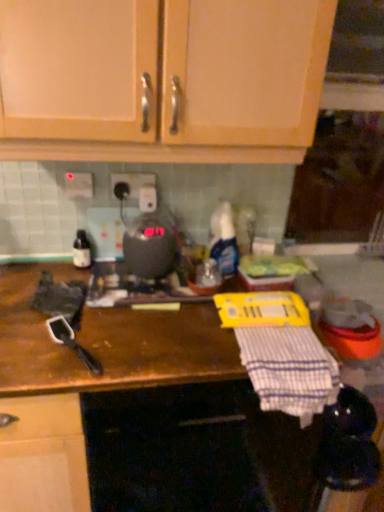
What do you see at coordinates (81, 250) in the screenshot? Image resolution: width=384 pixels, height=512 pixels. I see `matte glass bottle at left, the 1th bottle viewed from the left` at bounding box center [81, 250].

Identify the location of white plastic electric outlet at center, the 2th electric outlet positioned from the left. The image size is (384, 512). click(x=133, y=182).

You are a GUI agent. You are given a task and a screenshot of the screen. Output one action in this format:
    pyautogui.click(x=<x>, y=<y>)
    Task: Click on the wooden cabinet doors at upper center
    The width and height of the screenshot is (384, 512).
    Given the screenshot: What is the action you would take?
    pyautogui.click(x=162, y=79)

This screenshot has width=384, height=512. What do you see at coordinates (148, 412) in the screenshot?
I see `brown wooden countertop at center` at bounding box center [148, 412].

The image size is (384, 512). Describe the element at coordinates (78, 184) in the screenshot. I see `white plastic electric outlet at upper center, arranged as the 2th electric outlet when viewed from the right` at that location.

The height and width of the screenshot is (512, 384). Identify the location of white plastic electric outlet at upper center, arranged as the 2th electric outlet when viewed from the right. (78, 184).

Locate an element on the screen. translucent plastic spray bottle at center, acting as the second bottle starting from the left is located at coordinates (224, 239).

Image resolution: width=384 pixels, height=512 pixels. What are the coordinates of `matte glass bottle at left, the 1th bottle viewed from the left` in the screenshot? It's located at (81, 250).

How far apart are metallic gray toaster at center and wooden cabinet doors at upper center?

The distance of metallic gray toaster at center from wooden cabinet doors at upper center is 46.27 centimeters.

Considering the relative sizes of metallic gray toaster at center and wooden cabinet doors at upper center in the image provided, is metallic gray toaster at center smaller than wooden cabinet doors at upper center?

Indeed, metallic gray toaster at center has a smaller size compared to wooden cabinet doors at upper center.

From the image's perspective, between metallic gray toaster at center and wooden cabinet doors at upper center, who is located below?

From the image's view, metallic gray toaster at center is below.

Does metallic gray toaster at center have a greater width compared to wooden cabinet doors at upper center?

Incorrect, the width of metallic gray toaster at center does not surpass that of wooden cabinet doors at upper center.

Is wooden cabinet doors at upper center outside of brown wooden countertop at center?

Yes, wooden cabinet doors at upper center is located beyond the bounds of brown wooden countertop at center.

From a real-world perspective, is wooden cabinet doors at upper center physically located above or below brown wooden countertop at center?

wooden cabinet doors at upper center is situated higher than brown wooden countertop at center in the real world.

Considering the sizes of objects wooden cabinet doors at upper center and brown wooden countertop at center in the image provided, who is wider, wooden cabinet doors at upper center or brown wooden countertop at center?

Wider between the two is brown wooden countertop at center.

Do you think matte glass bottle at left, the 1th bottle viewed from the left, is within brown wooden countertop at center, or outside of it?

matte glass bottle at left, the 1th bottle viewed from the left, is spatially situated outside brown wooden countertop at center.

From the image's perspective, relative to brown wooden countertop at center, is matte glass bottle at left, the 1th bottle viewed from the left, above or below?

matte glass bottle at left, the 1th bottle viewed from the left, is situated higher than brown wooden countertop at center in the image.

The height and width of the screenshot is (512, 384). In order to click on bottle lying on the left of brown wooden countertop at center in this screenshot , I will do `click(81, 250)`.

Considering the relative sizes of matte glass bottle at left, the 1th bottle viewed from the left, and brown wooden countertop at center in the image provided, is matte glass bottle at left, the 1th bottle viewed from the left, taller than brown wooden countertop at center?

In fact, matte glass bottle at left, the 1th bottle viewed from the left, may be shorter than brown wooden countertop at center.

Considering the sizes of objects matte glass bottle at left, the 1th bottle viewed from the left, and translucent plastic spray bottle at center, the 1th bottle when ordered from right to left, in the image provided, who is smaller, matte glass bottle at left, the 1th bottle viewed from the left, or translucent plastic spray bottle at center, the 1th bottle when ordered from right to left,?

matte glass bottle at left, the 1th bottle viewed from the left, is smaller.

Would you say matte glass bottle at left, which is the second bottle in right-to-left order, is inside or outside translucent plastic spray bottle at center, the 1th bottle when ordered from right to left?

matte glass bottle at left, which is the second bottle in right-to-left order, exists outside the volume of translucent plastic spray bottle at center, the 1th bottle when ordered from right to left.

Relative to translucent plastic spray bottle at center, acting as the second bottle starting from the left, is matte glass bottle at left, which is the second bottle in right-to-left order, in front or behind?

Clearly, matte glass bottle at left, which is the second bottle in right-to-left order, is behind translucent plastic spray bottle at center, acting as the second bottle starting from the left.

What's the angular difference between matte glass bottle at left, the 1th bottle viewed from the left, and translucent plastic spray bottle at center, the 1th bottle when ordered from right to left,'s facing directions?

The angular difference between matte glass bottle at left, the 1th bottle viewed from the left, and translucent plastic spray bottle at center, the 1th bottle when ordered from right to left, is 0.00238 degrees.

Is matte glass bottle at left, the 1th bottle viewed from the left, positioned behind white plastic electric outlet at center, the 2th electric outlet positioned from the left?

Yes, it is.

From a real-world perspective, is matte glass bottle at left, the 1th bottle viewed from the left, positioned above or below white plastic electric outlet at center, the 1th electric outlet in the right-to-left sequence?

From a real-world perspective, matte glass bottle at left, the 1th bottle viewed from the left, is physically below white plastic electric outlet at center, the 1th electric outlet in the right-to-left sequence.

Based on the photo, which object is wider, matte glass bottle at left, which is the second bottle in right-to-left order, or white plastic electric outlet at center, the 1th electric outlet in the right-to-left sequence?

Wider between the two is matte glass bottle at left, which is the second bottle in right-to-left order.

How different are the orientations of matte glass bottle at left, which is the second bottle in right-to-left order, and white plastic electric outlet at center, the 2th electric outlet positioned from the left, in degrees?

They differ by 1.03 degrees in their facing directions.

Would you say white checkered cloth at lower right is outside wooden cabinet doors at upper center?

white checkered cloth at lower right lies outside wooden cabinet doors at upper center's area.

Find the location of a particular element. The width and height of the screenshot is (384, 512). cabinetry on the left of white checkered cloth at lower right is located at coordinates (162, 79).

Is white checkered cloth at lower right facing towards wooden cabinet doors at upper center?

No, white checkered cloth at lower right is not oriented towards wooden cabinet doors at upper center.

Based on the photo, how many degrees apart are the facing directions of white checkered cloth at lower right and wooden cabinet doors at upper center?

There is a 0.00173-degree angle between the facing directions of white checkered cloth at lower right and wooden cabinet doors at upper center.

From a real-world perspective, does wooden cabinet doors at upper center sit lower than white checkered cloth at lower right?

No.

Can white checkered cloth at lower right be found inside wooden cabinet doors at upper center?

No, white checkered cloth at lower right is located outside of wooden cabinet doors at upper center.

Which is more distant, (186, 5) or (302, 408)?

Point (302, 408)

This screenshot has height=512, width=384. Identify the location of cabinetry above the metallic gray toaster at center (from a real-world perspective). (162, 79).

Image resolution: width=384 pixels, height=512 pixels. What are the coordinates of `countertop below the wooden cabinet doors at upper center (from a real-world perspective)` in the screenshot? It's located at (148, 412).

Based on their spatial positions, is translucent plastic spray bottle at center, acting as the second bottle starting from the left, or metallic gray toaster at center further from white checkered cloth at lower right?

Based on the image, metallic gray toaster at center appears to be further to white checkered cloth at lower right.

Considering their positions, is translucent plastic spray bottle at center, acting as the second bottle starting from the left, positioned further to white plastic electric outlet at center, the 2th electric outlet positioned from the left, than white plastic electric outlet at upper center, arranged as the 2th electric outlet when viewed from the right?

translucent plastic spray bottle at center, acting as the second bottle starting from the left, lies further to white plastic electric outlet at center, the 2th electric outlet positioned from the left, than the other object.

Considering their positions, is brown wooden countertop at center positioned further to matte glass bottle at left, which is the second bottle in right-to-left order, than metallic gray toaster at center?

Among the two, brown wooden countertop at center is located further to matte glass bottle at left, which is the second bottle in right-to-left order.

When comparing their distances from white plastic electric outlet at center, the 2th electric outlet positioned from the left, does brown wooden countertop at center or wooden cabinet doors at upper center seem closer?

The object closer to white plastic electric outlet at center, the 2th electric outlet positioned from the left, is wooden cabinet doors at upper center.

Considering their positions, is translucent plastic spray bottle at center, acting as the second bottle starting from the left, positioned closer to brown wooden countertop at center than matte glass bottle at left, the 1th bottle viewed from the left?

translucent plastic spray bottle at center, acting as the second bottle starting from the left.

Looking at the image, which one is located further to white plastic electric outlet at center, the 2th electric outlet positioned from the left, translucent plastic spray bottle at center, acting as the second bottle starting from the left, or metallic gray toaster at center?

translucent plastic spray bottle at center, acting as the second bottle starting from the left, is positioned further to the anchor white plastic electric outlet at center, the 2th electric outlet positioned from the left.

Looking at the image, which one is located closer to brown wooden countertop at center, matte glass bottle at left, which is the second bottle in right-to-left order, or white plastic electric outlet at center, the 2th electric outlet positioned from the left?

matte glass bottle at left, which is the second bottle in right-to-left order, is positioned closer to the anchor brown wooden countertop at center.

When comparing their distances from white checkered cloth at lower right, does white plastic electric outlet at center, the 1th electric outlet in the right-to-left sequence, or white plastic electric outlet at upper center, arranged as the 2th electric outlet when viewed from the right, seem closer?

white plastic electric outlet at center, the 1th electric outlet in the right-to-left sequence, lies closer to white checkered cloth at lower right than the other object.

Identify the location of appliance between white plastic electric outlet at center, the 2th electric outlet positioned from the left, and white checkered cloth at lower right, in the vertical direction. This screenshot has height=512, width=384. (149, 249).

You are a GUI agent. You are given a task and a screenshot of the screen. Output one action in this format:
    pyautogui.click(x=<x>, y=<y>)
    Task: Click on the appliance located between wooden cabinet doors at upper center and white plastic electric outlet at center, the 1th electric outlet in the right-to-left sequence, in the depth direction
    The image size is (384, 512).
    Given the screenshot: What is the action you would take?
    pyautogui.click(x=149, y=249)

Identify the location of bottle between matte glass bottle at left, which is the second bottle in right-to-left order, and white checkered cloth at lower right, in the horizontal direction. (224, 239).

Locate an element on the screen. The width and height of the screenshot is (384, 512). appliance between white plastic electric outlet at center, the 1th electric outlet in the right-to-left sequence, and translucent plastic spray bottle at center, acting as the second bottle starting from the left is located at coordinates (149, 249).